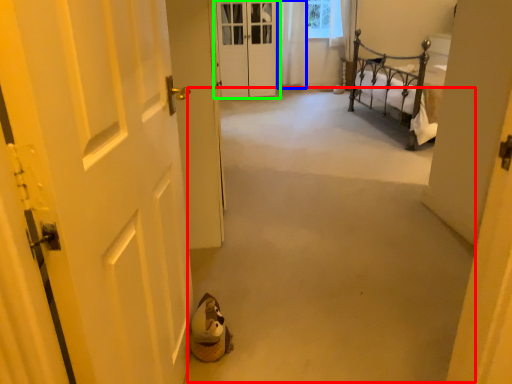
Question: Which is farther away from corridor (highlighted by a red box)? curtain (highlighted by a blue box) or door (highlighted by a green box)?

Choices:
 (A) curtain
 (B) door

Answer: (A)